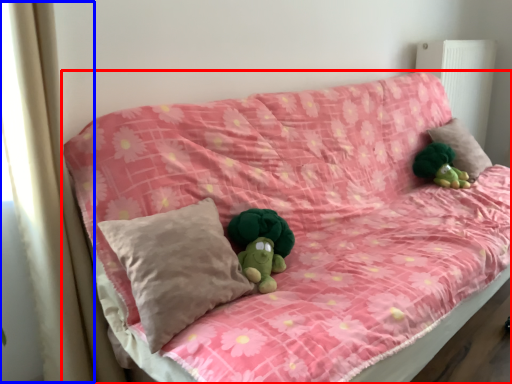
Question: Which point is further to the camera, furniture (highlighted by a red box) or curtain (highlighted by a blue box)?

Choices:
 (A) furniture
 (B) curtain

Answer: (B)